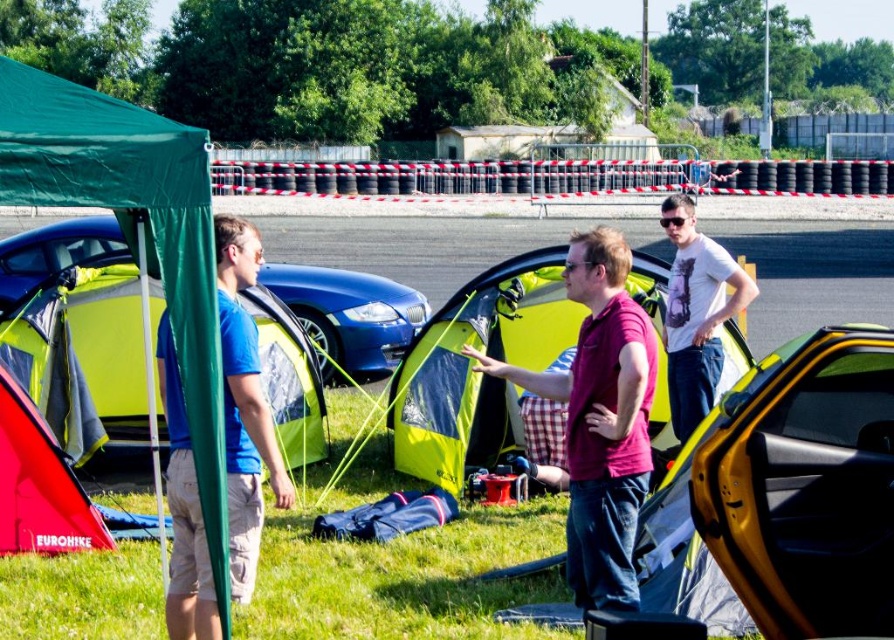
You are standing at the origin point of the coordinate system. You want to move towards the shiny blue car at center. What direction should you move in?

Since the shiny blue car at center is located at coordinates approximately 0.494 in the x direction and 0.391 in the y direction, you should move northeast to reach it.

You are standing at the center of the image. Which direction should you walk to reach the green fabric canopy at left?

You should walk to the left to reach the green fabric canopy at left since it is located at point (x=133, y=228), which is to the left of the center.

You are a parking attendant at the event and need to move a 2.5 meter long truck between the shiny blue car at center and the glossy blue car at center. Is there enough space for the truck to pass through?

The distance between the shiny blue car at center and the glossy blue car at center is 2.23 meters. Since the truck is 2.5 meters long, it is longer than the available space. Therefore, the truck cannot pass through the gap between them.